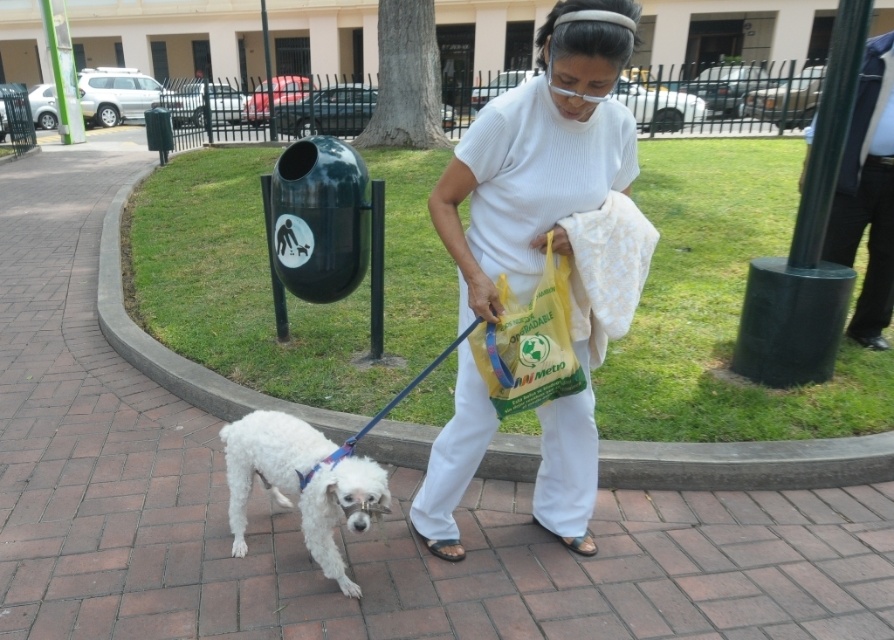
You are a photographer trying to capture a photo of the white ribbed shirt at center and the white fluffy dog at lower left. From the dog owner perspective, which object is located to the right side?

The white ribbed shirt at center is located to the right of the white fluffy dog at lower left.

You are a photographer taking a portrait of the woman and her dog. The white ribbed shirt at center and the white fluffy dog at lower left are both in the frame. Which object should you focus on if you want to capture the taller one?

The white ribbed shirt at center should be focused on because it has a greater height compared to the white fluffy dog at lower left.

You are the woman in the image holding the dog leash. You want to walk your dog to the green trash bin for waste disposal. The trash bin is located at point (x=340, y=586). However, there is an obstacle at point (x=579, y=150). Which point should you avoid to reach the trash bin safely?

You should avoid the obstacle at point (x=579, y=150) because it is in front of the path leading to the trash bin at point (x=340, y=586).